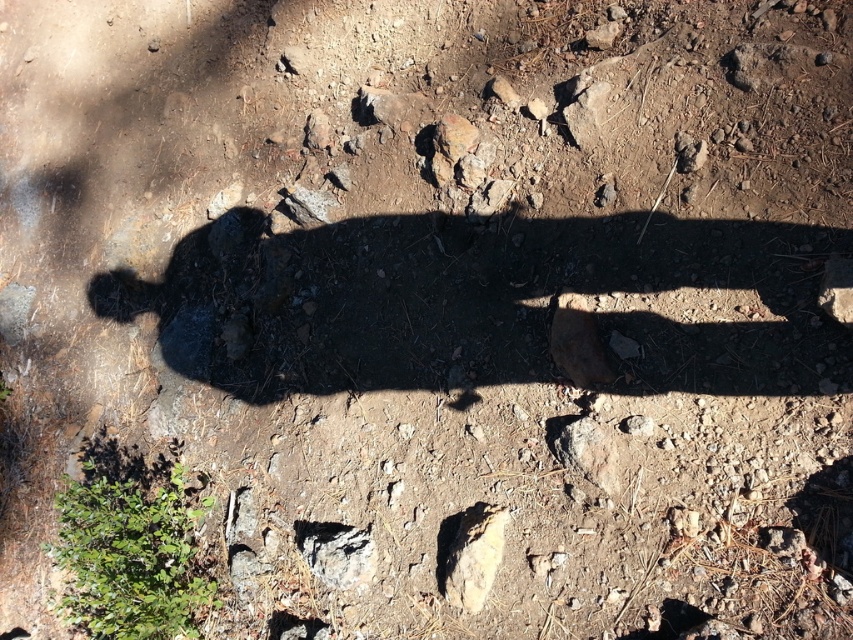
Question: Observing the image, what is the correct spatial positioning of smooth beige rock at lower center in reference to gray rough rock at center?

Choices:
 (A) left
 (B) right

Answer: (B)

Question: Which point is closer to the camera taking this photo?

Choices:
 (A) (299, 534)
 (B) (482, 512)

Answer: (B)

Question: Can you confirm if smooth beige rock at lower center is smaller than gray rough rock at center?

Choices:
 (A) no
 (B) yes

Answer: (B)

Question: Which point is closer to the camera?

Choices:
 (A) smooth beige rock at lower center
 (B) gray rough rock at center

Answer: (A)

Question: Is smooth beige rock at lower center to the right of gray rough rock at center from the viewer's perspective?

Choices:
 (A) no
 (B) yes

Answer: (B)

Question: Which object appears farthest from the camera in this image?

Choices:
 (A) gray rough rock at center
 (B) smooth beige rock at lower center

Answer: (A)